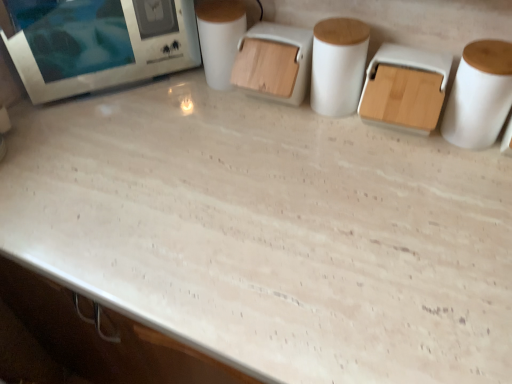
Locate an element on the screen. The width and height of the screenshot is (512, 384). vacant region in front of white glossy microwave at upper left is located at coordinates (112, 145).